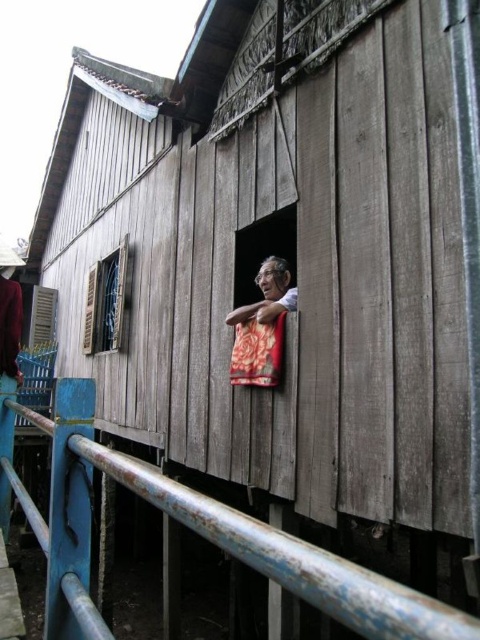
Is rusty metal railing at lower left wider than floral fabric at window?

Yes, rusty metal railing at lower left is wider than floral fabric at window.

Who is taller, rusty metal railing at lower left or floral fabric at window?

Standing taller between the two is rusty metal railing at lower left.

Identify the location of rusty metal railing at lower left. (202, 532).

Describe the element at coordinates (262, 326) in the screenshot. I see `floral fabric at window` at that location.

Locate an element on the screen. floral fabric at window is located at coordinates (262, 326).

Who is more forward, (243, 552) or (104, 301)?

Point (243, 552) is more forward.

Consider the image. Is rusty metal railing at lower left to the left of wooden shutter at left from the viewer's perspective?

No, rusty metal railing at lower left is not to the left of wooden shutter at left.

Who is more forward, (96, 460) or (128, 273)?

Point (96, 460) is more forward.

What are the coordinates of `rusty metal railing at lower left` in the screenshot? It's located at (202, 532).